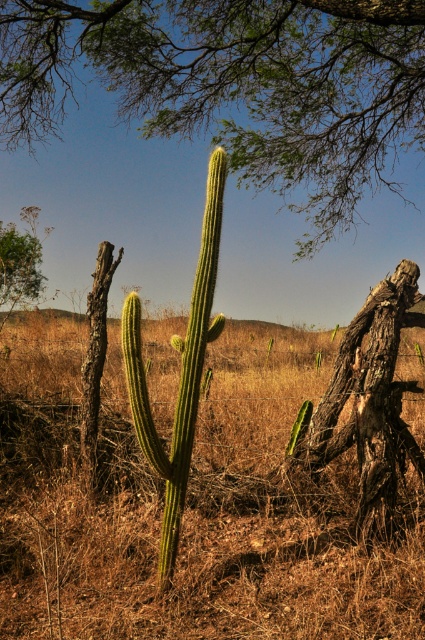
Question: Is green leafy tree at upper center behind green spiny cactus at center?

Choices:
 (A) yes
 (B) no

Answer: (A)

Question: Among these objects, which one is farthest from the camera?

Choices:
 (A) green spiny cactus at center
 (B) green dry grass at center
 (C) green leafy tree at upper center
 (D) rough bark tree trunk at right

Answer: (C)

Question: Among these objects, which one is nearest to the camera?

Choices:
 (A) green dry grass at center
 (B) green spiny cactus at center

Answer: (A)

Question: Is green dry grass at center further to camera compared to green spiny cactus at center?

Choices:
 (A) no
 (B) yes

Answer: (A)

Question: Which of the following is the closest to the observer?

Choices:
 (A) (186, 380)
 (B) (343, 74)
 (C) (357, 358)
 (D) (229, 515)

Answer: (A)

Question: Is green dry grass at center to the left of green leafy tree at upper center from the viewer's perspective?

Choices:
 (A) yes
 (B) no

Answer: (A)